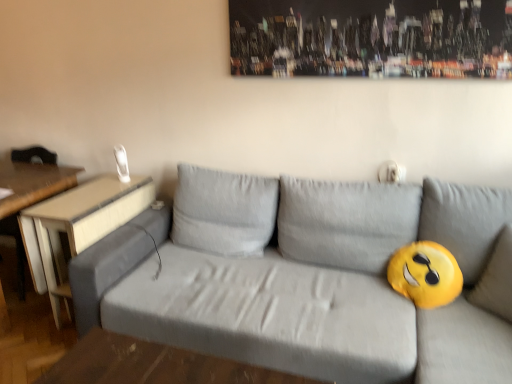
At what (x,y) coordinates should I click in order to perform the action: click on wooden table at left, the 2th table in the right-to-left sequence. Please return your answer as a coordinate pair (x, y). The width and height of the screenshot is (512, 384). Looking at the image, I should click on (30, 193).

The width and height of the screenshot is (512, 384). Identify the location of light brown wood table at left, which is the 2th table in left-to-right order. (78, 226).

Is light brown wood table at left, the first table when ordered from right to left, located outside gray fabric couch at center?

Yes, light brown wood table at left, the first table when ordered from right to left, is outside of gray fabric couch at center.

Considering the relative sizes of light brown wood table at left, the first table when ordered from right to left, and gray fabric couch at center in the image provided, is light brown wood table at left, the first table when ordered from right to left, smaller than gray fabric couch at center?

Yes, light brown wood table at left, the first table when ordered from right to left, is smaller than gray fabric couch at center.

Locate an element on the screen. studio couch that is above the light brown wood table at left, which is the 2th table in left-to-right order (from a real-world perspective) is located at coordinates (308, 278).

Considering the relative positions of light brown wood table at left, the first table when ordered from right to left, and gray fabric couch at center in the image provided, is light brown wood table at left, the first table when ordered from right to left, in front of gray fabric couch at center?

That is False.

From the image's perspective, which one is positioned higher, wooden table at left, the 1th table when ordered from left to right, or light brown wood table at left, which is the 2th table in left-to-right order?

wooden table at left, the 1th table when ordered from left to right.

Find the location of a particular element. table located in front of the wooden table at left, the 1th table when ordered from left to right is located at coordinates (78, 226).

Which of these two, wooden table at left, the 2th table in the right-to-left sequence, or light brown wood table at left, which is the 2th table in left-to-right order, stands shorter?

With less height is light brown wood table at left, which is the 2th table in left-to-right order.

Considering the relative sizes of wooden table at left, the 2th table in the right-to-left sequence, and light brown wood table at left, which is the 2th table in left-to-right order, in the image provided, is wooden table at left, the 2th table in the right-to-left sequence, thinner than light brown wood table at left, which is the 2th table in left-to-right order,?

Indeed, wooden table at left, the 2th table in the right-to-left sequence, has a lesser width compared to light brown wood table at left, which is the 2th table in left-to-right order.

From the image's perspective, does gray fabric couch at center appear lower than light brown wood table at left, the first table when ordered from right to left?

Indeed, from the image's perspective, gray fabric couch at center is shown beneath light brown wood table at left, the first table when ordered from right to left.

Locate an element on the screen. The image size is (512, 384). studio couch below the light brown wood table at left, the first table when ordered from right to left (from the image's perspective) is located at coordinates point(308,278).

Between gray fabric couch at center and light brown wood table at left, which is the 2th table in left-to-right order, which one has smaller width?

light brown wood table at left, which is the 2th table in left-to-right order.

Is gray fabric couch at center oriented towards light brown wood table at left, the first table when ordered from right to left?

No, gray fabric couch at center is not oriented towards light brown wood table at left, the first table when ordered from right to left.

Based on their positions, is gray fabric couch at center located to the left or right of wooden table at left, the 2th table in the right-to-left sequence?

In the image, gray fabric couch at center appears on the right side of wooden table at left, the 2th table in the right-to-left sequence.

Considering the positions of points (509, 320) and (11, 209), is point (509, 320) farther from camera compared to point (11, 209)?

No, (509, 320) is in front of (11, 209).

What's the angular difference between light brown wood table at left, which is the 2th table in left-to-right order, and wooden table at left, the 1th table when ordered from left to right,'s facing directions?

The angular difference between light brown wood table at left, which is the 2th table in left-to-right order, and wooden table at left, the 1th table when ordered from left to right, is 2.81 degrees.

Who is bigger, light brown wood table at left, which is the 2th table in left-to-right order, or wooden table at left, the 2th table in the right-to-left sequence?

Bigger between the two is wooden table at left, the 2th table in the right-to-left sequence.

Looking at this image, from a real-world perspective, is light brown wood table at left, which is the 2th table in left-to-right order, located higher than wooden table at left, the 1th table when ordered from left to right?

No, from a real-world perspective, light brown wood table at left, which is the 2th table in left-to-right order, is not above wooden table at left, the 1th table when ordered from left to right.

From the picture: Considering the relative sizes of light brown wood table at left, which is the 2th table in left-to-right order, and wooden table at left, the 2th table in the right-to-left sequence, in the image provided, is light brown wood table at left, which is the 2th table in left-to-right order, thinner than wooden table at left, the 2th table in the right-to-left sequence,?

No.

From the image's perspective, is wooden table at left, the 1th table when ordered from left to right, on top of gray fabric couch at center?

Yes, from the image's perspective, wooden table at left, the 1th table when ordered from left to right, is above gray fabric couch at center.

From a real-world perspective, is wooden table at left, the 2th table in the right-to-left sequence, on top of gray fabric couch at center?

No, from a real-world perspective, wooden table at left, the 2th table in the right-to-left sequence, is not on top of gray fabric couch at center.

Can we say wooden table at left, the 1th table when ordered from left to right, lies outside gray fabric couch at center?

Yes, wooden table at left, the 1th table when ordered from left to right, is outside of gray fabric couch at center.

Consider the image. Is wooden table at left, the 1th table when ordered from left to right, looking in the opposite direction of gray fabric couch at center?

No, wooden table at left, the 1th table when ordered from left to right, is not facing away from gray fabric couch at center.

The width and height of the screenshot is (512, 384). What are the coordinates of `studio couch on the right of light brown wood table at left, the first table when ordered from right to left` in the screenshot? It's located at (308, 278).

Find the location of `table above the light brown wood table at left, the first table when ordered from right to left (from the image's perspective)`. table above the light brown wood table at left, the first table when ordered from right to left (from the image's perspective) is located at coordinates pyautogui.click(x=30, y=193).

When comparing their distances from gray fabric couch at center, does light brown wood table at left, the first table when ordered from right to left, or wooden table at left, the 1th table when ordered from left to right, seem closer?

The object closer to gray fabric couch at center is light brown wood table at left, the first table when ordered from right to left.

Looking at the image, which one is located further to wooden table at left, the 2th table in the right-to-left sequence, gray fabric couch at center or light brown wood table at left, the first table when ordered from right to left?

Based on the image, gray fabric couch at center appears to be further to wooden table at left, the 2th table in the right-to-left sequence.

From the image, which object appears to be nearer to light brown wood table at left, which is the 2th table in left-to-right order, gray fabric couch at center or wooden table at left, the 1th table when ordered from left to right?

Based on the image, wooden table at left, the 1th table when ordered from left to right, appears to be nearer to light brown wood table at left, which is the 2th table in left-to-right order.

Based on the photo, from the image, which object appears to be farther from gray fabric couch at center, wooden table at left, the 2th table in the right-to-left sequence, or light brown wood table at left, which is the 2th table in left-to-right order?

The object further to gray fabric couch at center is wooden table at left, the 2th table in the right-to-left sequence.

Based on their spatial positions, is light brown wood table at left, the first table when ordered from right to left, or gray fabric couch at center closer to wooden table at left, the 1th table when ordered from left to right?

light brown wood table at left, the first table when ordered from right to left, lies closer to wooden table at left, the 1th table when ordered from left to right, than the other object.

Looking at the image, which one is located closer to light brown wood table at left, which is the 2th table in left-to-right order, wooden table at left, the 2th table in the right-to-left sequence, or gray fabric couch at center?

wooden table at left, the 2th table in the right-to-left sequence, is closer to light brown wood table at left, which is the 2th table in left-to-right order.

Locate an element on the screen. This screenshot has width=512, height=384. table between gray fabric couch at center and wooden table at left, the 1th table when ordered from left to right, along the z-axis is located at coordinates click(x=78, y=226).